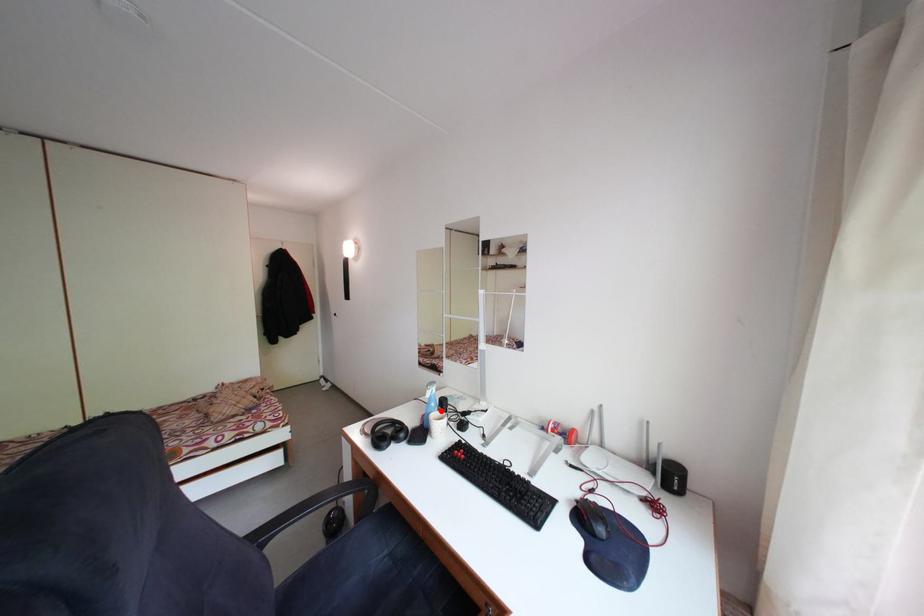
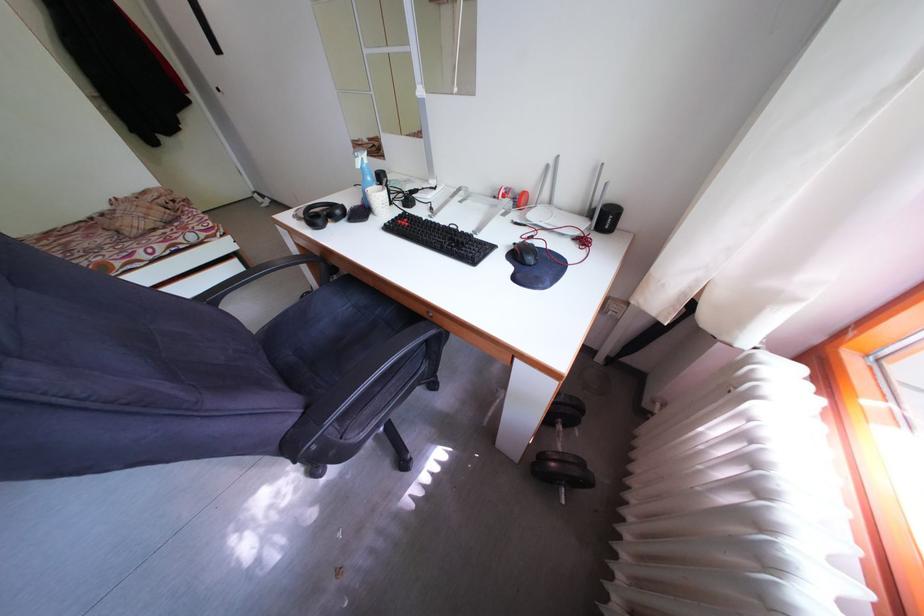
Question: I am providing you with two images of the same scene from different viewpoints. Given a red point in image1, look at the same physical point in image2. Is it:

Choices:
 (A) Closer to the viewpoint
 (B) Farther from the viewpoint

Answer: (A)